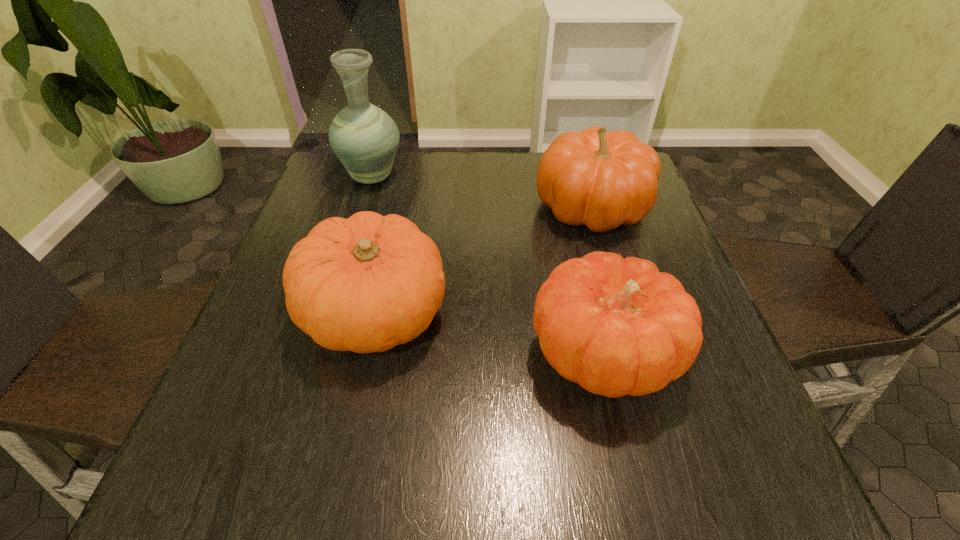
Choose which pumpkin is the nearest neighbor to the leftmost pumpkin. Please provide its 2D coordinates. Your answer should be formatted as a tuple, i.e. [(x, y)], where the tuple contains the x and y coordinates of a point satisfying the conditions above.

[(617, 327)]

I want to click on pumpkin that stands as the closest to the leftmost pumpkin, so click(617, 327).

Image resolution: width=960 pixels, height=540 pixels. Identify the location of vacant region that satisfies the following two spatial constraints: 1. on the back side of the farthest pumpkin; 2. on the right side of the leftmost pumpkin. 398,207.